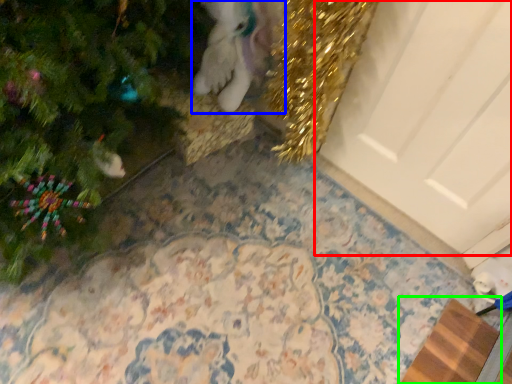
Question: Which object is the farthest from door (highlighted by a red box)? Choose among these: animal (highlighted by a blue box) or doormat (highlighted by a green box).

Choices:
 (A) animal
 (B) doormat

Answer: (B)